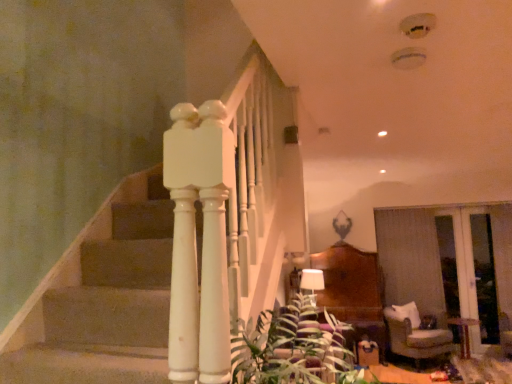
What is the approximate width of transparent glass door at right?

6.36 inches.

The width and height of the screenshot is (512, 384). What are the coordinates of `wooden glossy table at lower right` in the screenshot? It's located at (463, 333).

Locate an element on the screen. transparent glass door at right is located at coordinates (469, 269).

The image size is (512, 384). Find the location of `plant in front of the white fabric lampshade at center`. plant in front of the white fabric lampshade at center is located at coordinates (293, 348).

Do you think green leafy plant at lower center is within white fabric lampshade at center, or outside of it?

The correct answer is: outside.

Considering the positions of objects green leafy plant at lower center and white fabric lampshade at center in the image provided, who is behind, green leafy plant at lower center or white fabric lampshade at center?

white fabric lampshade at center is further away from the camera.

Is beige fabric armchair at lower right in front of or behind transparent glass door at right in the image?

beige fabric armchair at lower right is in front of transparent glass door at right.

Is beige fabric armchair at lower right oriented towards transparent glass door at right?

No, beige fabric armchair at lower right is not aimed at transparent glass door at right.

Which point is more distant from viewer, (x=390, y=334) or (x=487, y=228)?

Point (x=487, y=228)

Who is smaller, beige fabric armchair at lower right or transparent glass door at right?

With smaller size is transparent glass door at right.

From a real-world perspective, is white fabric lampshade at center physically located above or below beige fabric armchair at lower right?

In terms of real-world spatial position, white fabric lampshade at center is above beige fabric armchair at lower right.

Is white fabric lampshade at center oriented towards beige fabric armchair at lower right?

Yes, white fabric lampshade at center is facing beige fabric armchair at lower right.

Can you confirm if white fabric lampshade at center is taller than beige fabric armchair at lower right?

Incorrect, the height of white fabric lampshade at center is not larger of that of beige fabric armchair at lower right.

Which is correct: transparent glass door at right is inside beige fabric armchair at lower right, or outside of it?

transparent glass door at right exists outside the volume of beige fabric armchair at lower right.

Does transparent glass door at right appear on the left side of beige fabric armchair at lower right?

Incorrect, transparent glass door at right is not on the left side of beige fabric armchair at lower right.

Does transparent glass door at right have a greater width compared to beige fabric armchair at lower right?

In fact, transparent glass door at right might be narrower than beige fabric armchair at lower right.

In terms of size, does transparent glass door at right appear bigger or smaller than beige fabric armchair at lower right?

Clearly, transparent glass door at right is smaller in size than beige fabric armchair at lower right.

Looking at their sizes, would you say beige fabric armchair at lower right is wider or thinner than green leafy plant at lower center?

Considering their sizes, beige fabric armchair at lower right looks slimmer than green leafy plant at lower center.

In the scene shown: Considering the sizes of objects beige fabric armchair at lower right and green leafy plant at lower center in the image provided, who is smaller, beige fabric armchair at lower right or green leafy plant at lower center?

beige fabric armchair at lower right is smaller.

Is beige fabric armchair at lower right not close to green leafy plant at lower center?

Yes, beige fabric armchair at lower right and green leafy plant at lower center are quite far apart.

Choose the correct answer: Is beige fabric armchair at lower right inside green leafy plant at lower center or outside it?

beige fabric armchair at lower right is not enclosed by green leafy plant at lower center.

Considering the relative sizes of wooden glossy table at lower right and transparent glass door at right in the image provided, is wooden glossy table at lower right taller than transparent glass door at right?

Incorrect, the height of wooden glossy table at lower right is not larger of that of transparent glass door at right.

Which is more to the right, wooden glossy table at lower right or transparent glass door at right?

transparent glass door at right.

In terms of size, does wooden glossy table at lower right appear bigger or smaller than transparent glass door at right?

Considering their sizes, wooden glossy table at lower right takes up less space than transparent glass door at right.

Considering the sizes of wooden glossy table at lower right and green leafy plant at lower center in the image, is wooden glossy table at lower right bigger or smaller than green leafy plant at lower center?

Considering their sizes, wooden glossy table at lower right takes up less space than green leafy plant at lower center.

Considering the points (460, 340) and (309, 303), which point is in front, point (460, 340) or point (309, 303)?

Positioned in front is point (309, 303).

Considering their positions, is wooden glossy table at lower right located in front of or behind green leafy plant at lower center?

In the image, wooden glossy table at lower right appears behind green leafy plant at lower center.

Is wooden glossy table at lower right at the left side of green leafy plant at lower center?

In fact, wooden glossy table at lower right is to the right of green leafy plant at lower center.

Locate an element on the screen. This screenshot has width=512, height=384. lamp behind the green leafy plant at lower center is located at coordinates (312, 283).

Locate an element on the screen. This screenshot has width=512, height=384. furniture below the transparent glass door at right (from a real-world perspective) is located at coordinates (415, 334).

Considering their positions, is green leafy plant at lower center positioned closer to wooden glossy table at lower right than beige fabric armchair at lower right?

beige fabric armchair at lower right lies closer to wooden glossy table at lower right than the other object.

Considering their positions, is transparent glass door at right positioned closer to wooden glossy table at lower right than beige fabric armchair at lower right?

The object closer to wooden glossy table at lower right is transparent glass door at right.

Estimate the real-world distances between objects in this image. Which object is further from green leafy plant at lower center, beige fabric armchair at lower right or transparent glass door at right?

transparent glass door at right is positioned further to the anchor green leafy plant at lower center.

Which object lies nearer to the anchor point green leafy plant at lower center, transparent glass door at right or white fabric lampshade at center?

The object closer to green leafy plant at lower center is white fabric lampshade at center.

Based on their spatial positions, is white fabric lampshade at center or beige fabric armchair at lower right further from green leafy plant at lower center?

beige fabric armchair at lower right is further to green leafy plant at lower center.

From the image, which object appears to be farther from green leafy plant at lower center, wooden glossy table at lower right or transparent glass door at right?

transparent glass door at right lies further to green leafy plant at lower center than the other object.

From the image, which object appears to be nearer to white fabric lampshade at center, wooden glossy table at lower right or green leafy plant at lower center?

green leafy plant at lower center is closer to white fabric lampshade at center.

When comparing their distances from white fabric lampshade at center, does green leafy plant at lower center or transparent glass door at right seem closer?

Among the two, green leafy plant at lower center is located nearer to white fabric lampshade at center.

Identify the location of table between beige fabric armchair at lower right and transparent glass door at right in the horizontal direction. The height and width of the screenshot is (384, 512). (463, 333).

Locate an element on the screen. The image size is (512, 384). table situated between white fabric lampshade at center and transparent glass door at right from left to right is located at coordinates (463, 333).

You are a GUI agent. You are given a task and a screenshot of the screen. Output one action in this format:
    pyautogui.click(x=<x>, y=<y>)
    Task: Click on the furniture between green leafy plant at lower center and wooden glossy table at lower right from left to right
    
    Given the screenshot: What is the action you would take?
    pyautogui.click(x=415, y=334)

Locate an element on the screen. This screenshot has height=384, width=512. lamp between green leafy plant at lower center and transparent glass door at right is located at coordinates (312, 283).